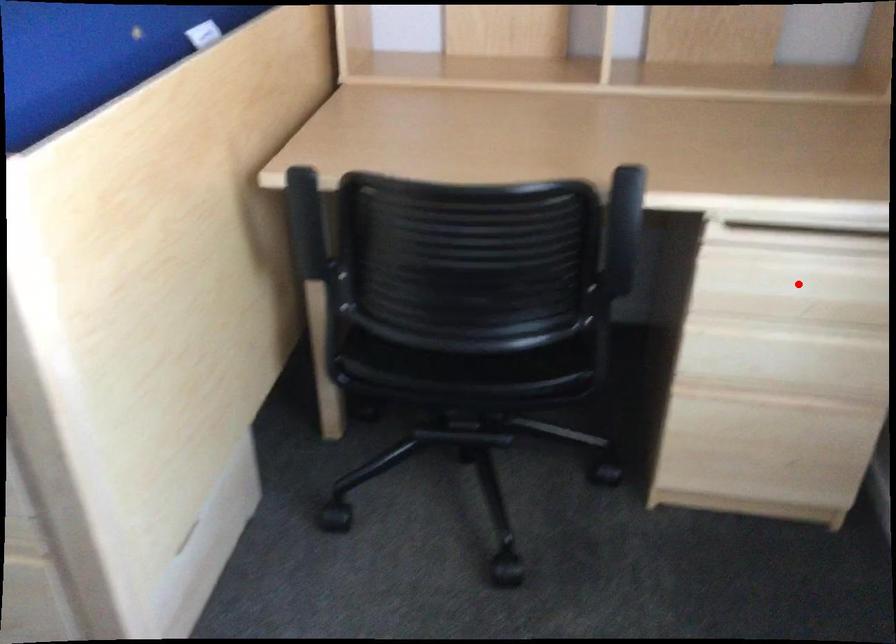
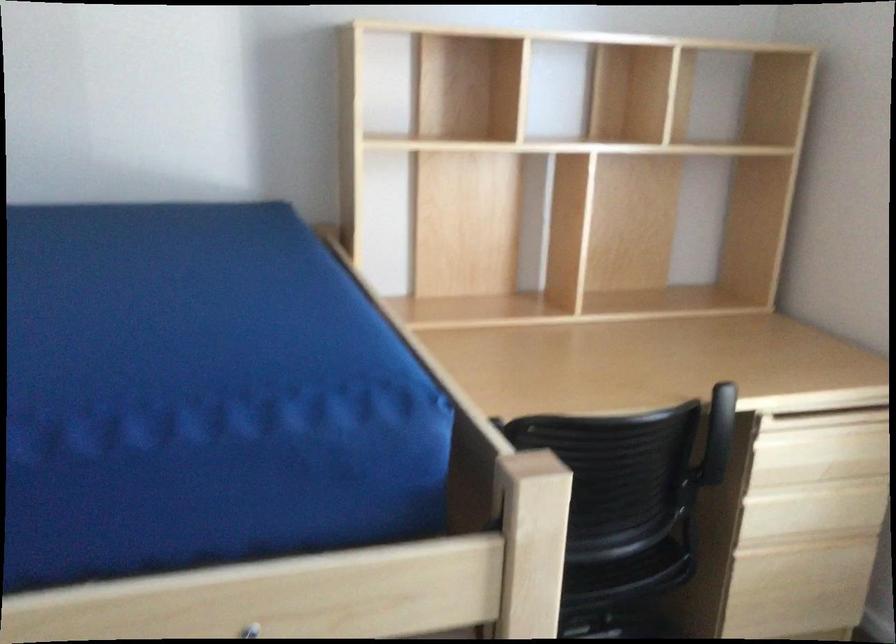
Where in the second image is the point corresponding to the highlighted location from the first image?

(819, 450)